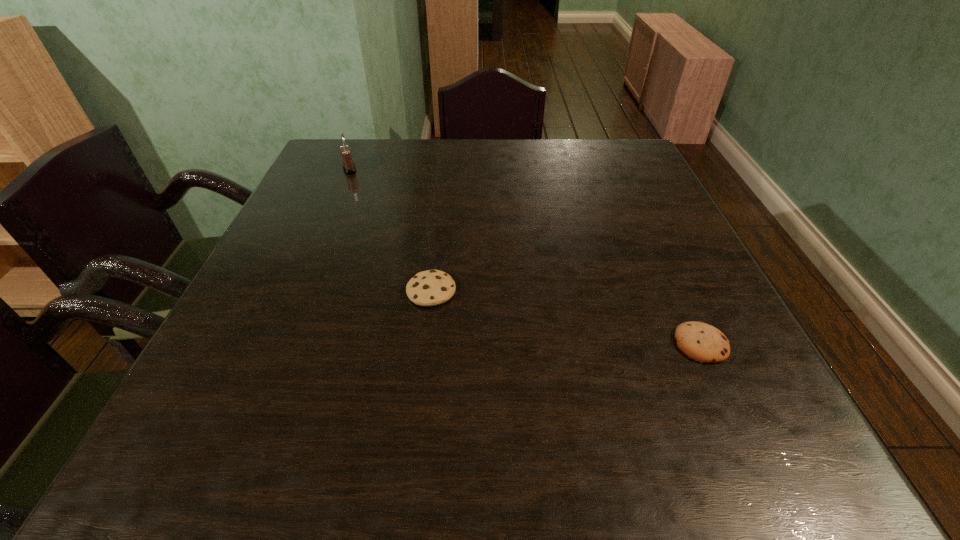
You are a GUI agent. You are given a task and a screenshot of the screen. Output one action in this format:
    pyautogui.click(x=<x>, y=<y>)
    Task: Click on the free spot between the padlock and the left cookie
    The height and width of the screenshot is (540, 960).
    Given the screenshot: What is the action you would take?
    pyautogui.click(x=391, y=230)

The height and width of the screenshot is (540, 960). I want to click on vacant area that lies between the shorter cookie and the taller cookie, so click(x=566, y=318).

Where is `vacant area between the left cookie and the rightmost object`? Image resolution: width=960 pixels, height=540 pixels. vacant area between the left cookie and the rightmost object is located at coordinates (566, 318).

The height and width of the screenshot is (540, 960). What are the coordinates of `unoccupied area between the second tallest object and the shorter cookie` in the screenshot? It's located at (566, 318).

Where is `vacant space that's between the rightmost object and the padlock`? The height and width of the screenshot is (540, 960). vacant space that's between the rightmost object and the padlock is located at coordinates (525, 256).

At what (x,y) coordinates should I click in order to perform the action: click on free space between the rightmost object and the tallest object. Please return your answer as a coordinate pair (x, y). Looking at the image, I should click on pos(525,256).

You are a GUI agent. You are given a task and a screenshot of the screen. Output one action in this format:
    pyautogui.click(x=<x>, y=<y>)
    Task: Click on the vacant area that lies between the nearer cookie and the farther cookie
    The width and height of the screenshot is (960, 540).
    Given the screenshot: What is the action you would take?
    pyautogui.click(x=566, y=318)

Where is `free spot between the tallest object and the taller cookie`? free spot between the tallest object and the taller cookie is located at coordinates (391, 230).

Image resolution: width=960 pixels, height=540 pixels. Identify the location of object that is the closest to the second farthest object. (702, 342).

The width and height of the screenshot is (960, 540). I want to click on object identified as the second closest to the right cookie, so click(x=349, y=167).